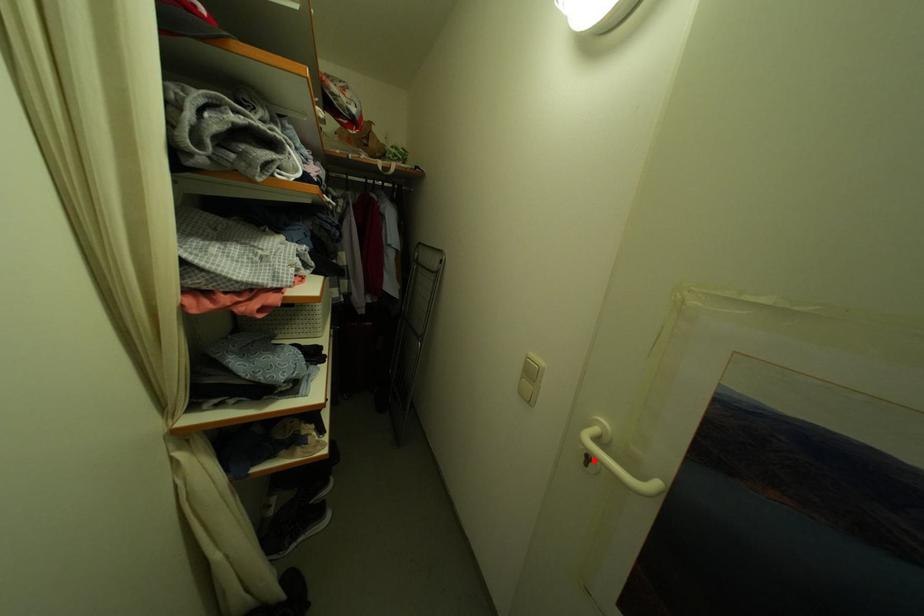
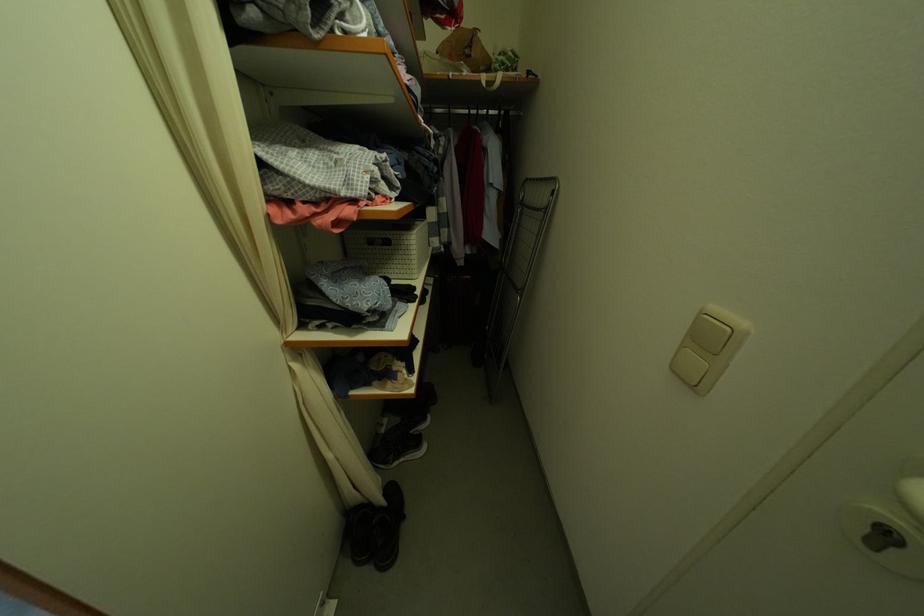
Find the pixel in the second image that matches the highlighted location in the first image.

(893, 537)